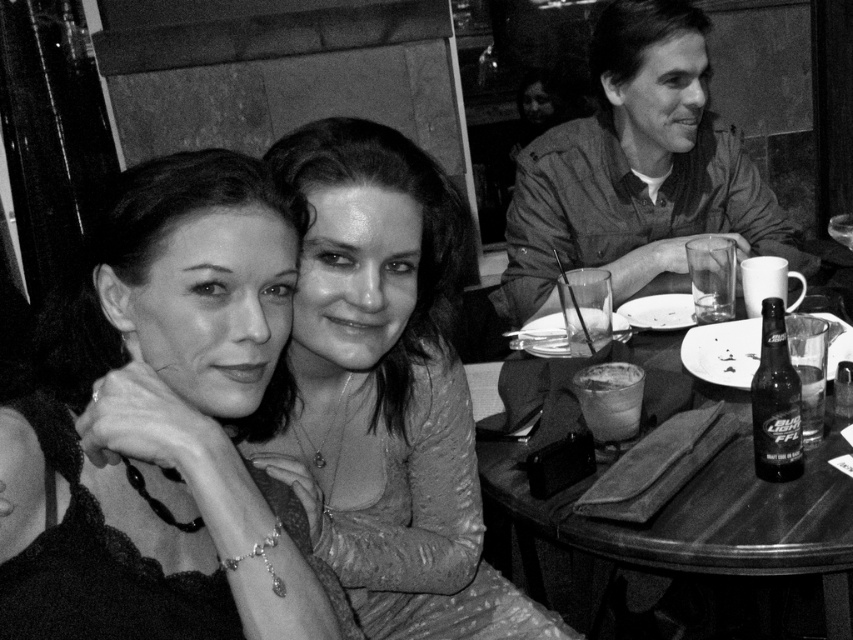
Question: Which point is farther to the camera?

Choices:
 (A) (79, 371)
 (B) (524, 579)
 (C) (526, 275)

Answer: (B)

Question: Which object is closer to the camera taking this photo?

Choices:
 (A) matte khaki shirt at upper right
 (B) smooth skin at center
 (C) smooth silk blouse at center

Answer: (B)

Question: Does smooth silk blouse at center appear over matte khaki shirt at upper right?

Choices:
 (A) no
 (B) yes

Answer: (A)

Question: Where is smooth skin at center located in relation to smooth wooden table at center in the image?

Choices:
 (A) right
 (B) left

Answer: (B)

Question: Which point is farther to the camera?

Choices:
 (A) smooth wooden table at center
 (B) smooth skin at center
 (C) smooth silk blouse at center
 (D) matte khaki shirt at upper right

Answer: (D)

Question: Can you confirm if smooth silk blouse at center is positioned below matte khaki shirt at upper right?

Choices:
 (A) no
 (B) yes

Answer: (B)